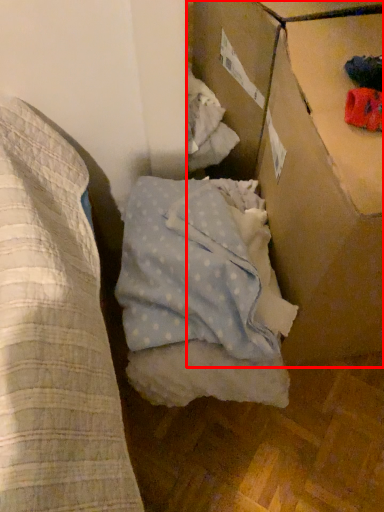
Question: Observing the image, what is the correct spatial positioning of cardboard box (annotated by the red box) in reference to sheet?

Choices:
 (A) right
 (B) left

Answer: (A)